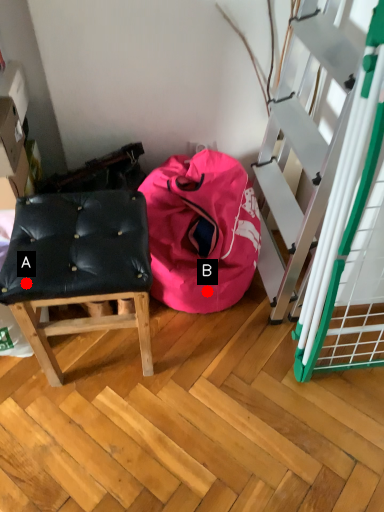
Question: Two points are circled on the image, labeled by A and B beside each circle. Among these points, which one is nearest to the camera?

Choices:
 (A) A is closer
 (B) B is closer

Answer: (A)